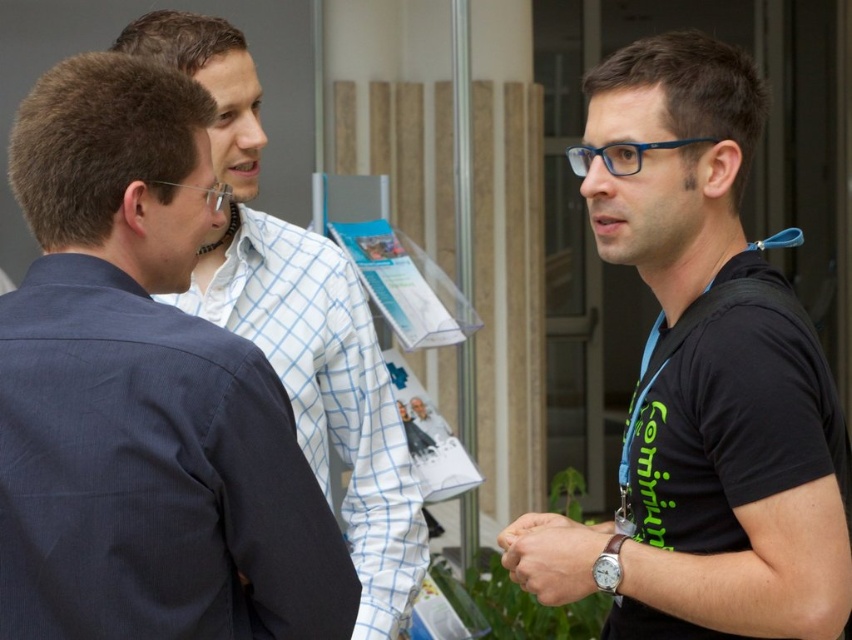
Question: Does blue checkered shirt at left appear under white checkered shirt at left?

Choices:
 (A) no
 (B) yes

Answer: (A)

Question: Among these points, which one is nearest to the camera?

Choices:
 (A) [37, 365]
 (B) [761, 273]
 (C) [370, 582]
 (D) [623, 458]

Answer: (A)

Question: Which point is farther from the camera taking this photo?

Choices:
 (A) (273, 525)
 (B) (539, 529)
 (C) (623, 540)
 (D) (648, 340)

Answer: (D)

Question: Is black matte t-shirt at center closer to the viewer compared to leather wristwatch at lower right?

Choices:
 (A) yes
 (B) no

Answer: (A)

Question: Which object is positioned farthest from the blue checkered shirt at left?

Choices:
 (A) blue fabric lanyard at right
 (B) black matte t-shirt at center
 (C) white checkered shirt at left
 (D) leather wristwatch at lower right

Answer: (A)

Question: From the image, what is the correct spatial relationship of leather wristwatch at lower right in relation to blue fabric lanyard at right?

Choices:
 (A) left
 (B) right

Answer: (A)